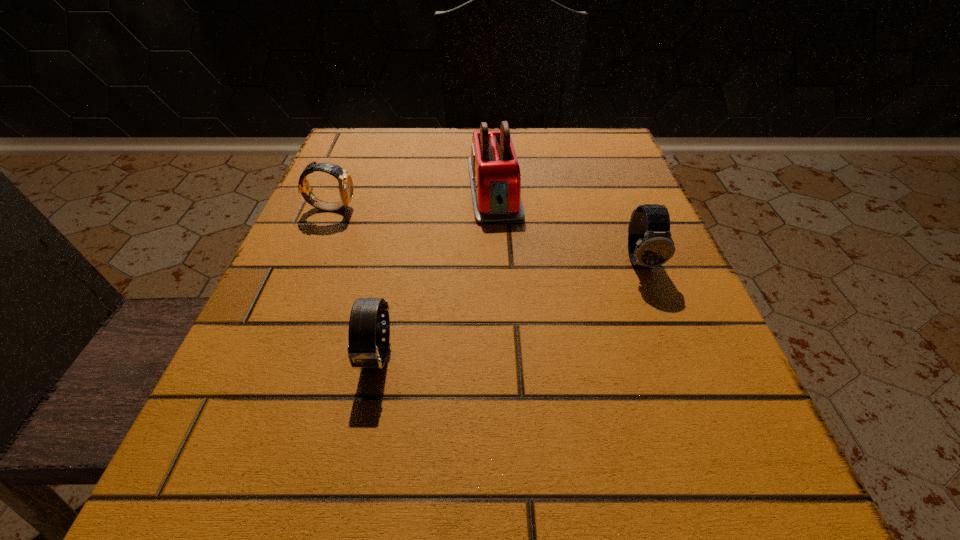
Where is `the tallest object`? the tallest object is located at coordinates (495, 178).

I want to click on the second object from right to left, so click(495, 178).

This screenshot has width=960, height=540. I want to click on the second nearest object, so click(x=650, y=244).

Where is `the rightmost watch`? The width and height of the screenshot is (960, 540). the rightmost watch is located at coordinates (650, 244).

You are a GUI agent. You are given a task and a screenshot of the screen. Output one action in this format:
    pyautogui.click(x=<x>, y=<y>)
    Task: Click on the leftmost object
    The image size is (960, 540).
    Given the screenshot: What is the action you would take?
    pyautogui.click(x=345, y=182)

Where is `the farthest watch`? the farthest watch is located at coordinates click(x=345, y=182).

The image size is (960, 540). In order to click on the nearest watch in this screenshot , I will do tap(365, 334).

I want to click on the second object from left to right, so [x=365, y=334].

At what (x,y) coordinates should I click in order to perform the action: click on vacant space located on the front of the tallest object. Please return your answer as a coordinate pair (x, y). The width and height of the screenshot is (960, 540). Looking at the image, I should click on (496, 242).

Where is `blank space located 0.340m on the face of the rightmost watch`? blank space located 0.340m on the face of the rightmost watch is located at coordinates (737, 510).